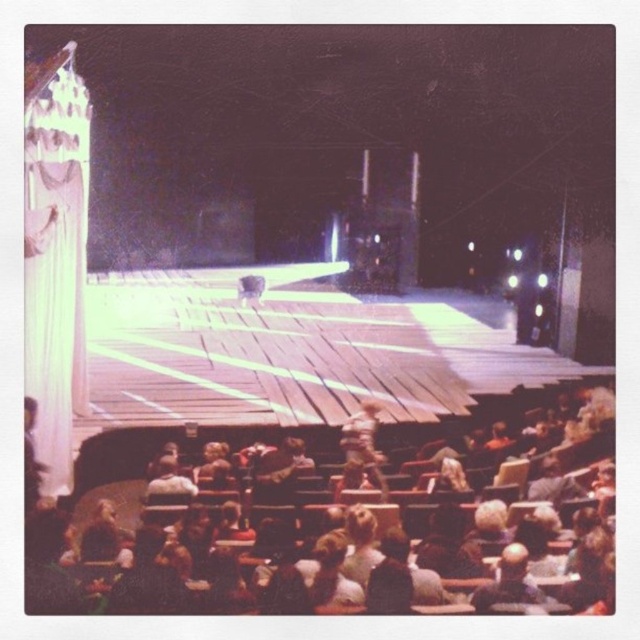
Can you confirm if wooden chair at lower center is shorter than wooden figure at center?

Yes, wooden chair at lower center is shorter than wooden figure at center.

Looking at this image, which of these two, wooden chair at lower center or wooden figure at center, stands taller?

wooden figure at center is taller.

Who is more forward, (289,480) or (342,445)?

Point (289,480) is more forward.

Locate an element on the screen. wooden chair at lower center is located at coordinates (304, 518).